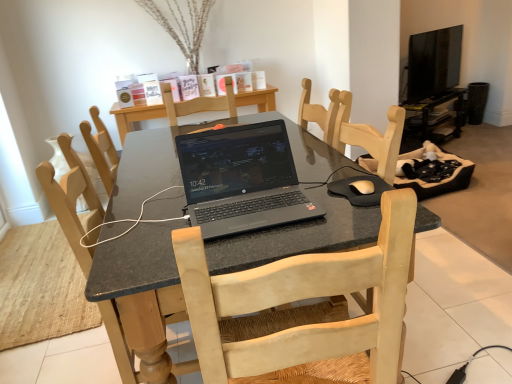
Where is `vacant space situated above black rubber mousepad at center (from a real-world perspective)`? The width and height of the screenshot is (512, 384). vacant space situated above black rubber mousepad at center (from a real-world perspective) is located at coordinates (354, 192).